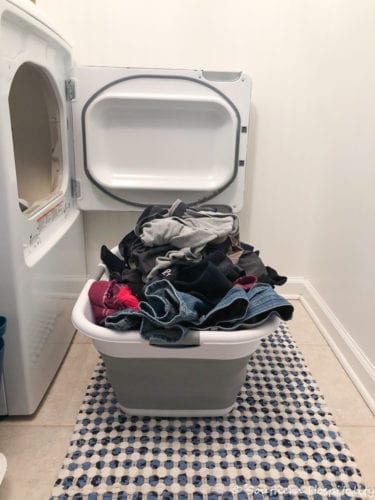
Locate an element on the screen. This screenshot has width=375, height=500. dryer door handle / opener is located at coordinates 226,75.